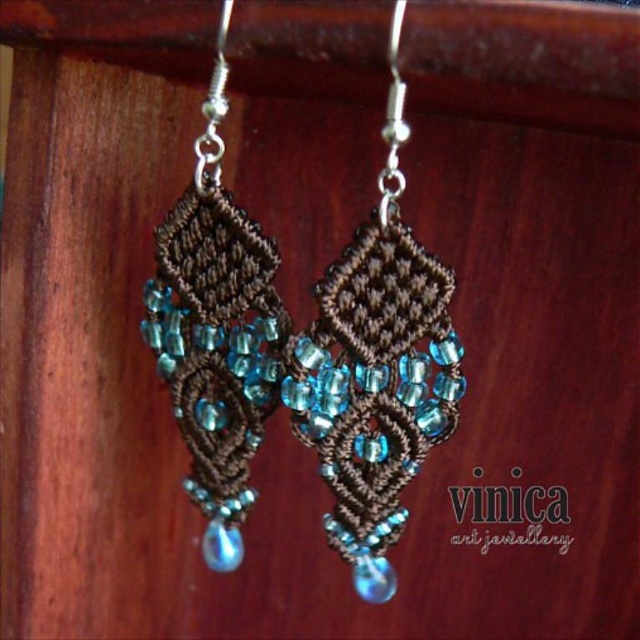
Is point (304, 408) less distant than point (204, 410)?

Yes, it is in front of point (204, 410).

Where is `matte brown macrame earrings at center`? matte brown macrame earrings at center is located at coordinates (376, 369).